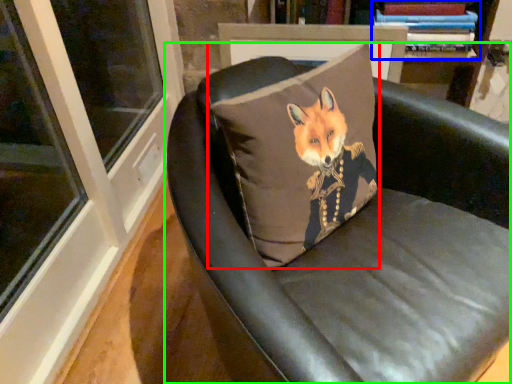
Question: Estimate the real-world distances between objects in this image. Which object is closer to pillow (highlighted by a red box), book (highlighted by a blue box) or chair (highlighted by a green box)?

Choices:
 (A) book
 (B) chair

Answer: (B)